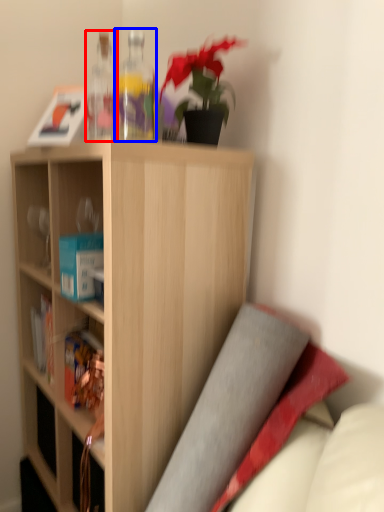
Question: Which object is closer to the camera taking this photo, bottle (highlighted by a red box) or bottle (highlighted by a blue box)?

Choices:
 (A) bottle
 (B) bottle

Answer: (B)